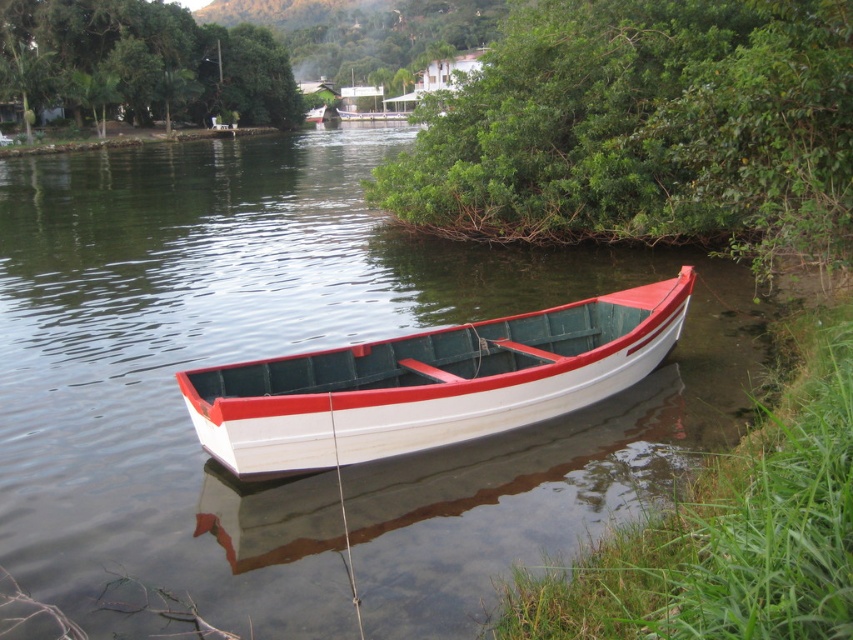
Question: Among these objects, which one is nearest to the camera?

Choices:
 (A) green leafy tree at upper center
 (B) green leafy bush at upper right

Answer: (B)

Question: Is green leafy bush at upper right further to the viewer compared to white matte boat at center?

Choices:
 (A) yes
 (B) no

Answer: (A)

Question: Does green leafy bush at upper right appear under white matte boat at center?

Choices:
 (A) no
 (B) yes

Answer: (A)

Question: Does green leafy bush at upper right have a lesser width compared to green leafy tree at upper center?

Choices:
 (A) yes
 (B) no

Answer: (A)

Question: Which object is positioned farthest from the white matte boat at center?

Choices:
 (A) green leafy bush at upper right
 (B) green leafy tree at upper center

Answer: (B)

Question: Which point is closer to the camera?

Choices:
 (A) (248, 458)
 (B) (88, 90)

Answer: (A)